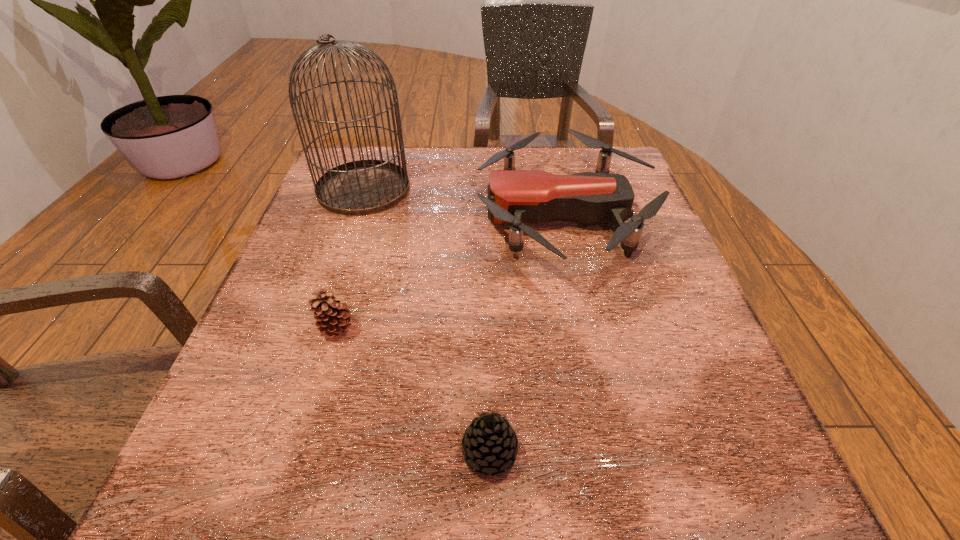
This screenshot has height=540, width=960. Identify the location of object that is at the far left corner. (363, 187).

This screenshot has height=540, width=960. Find the location of `object that is at the far right corner`. object that is at the far right corner is located at coordinates (517, 197).

This screenshot has height=540, width=960. In the image, there is a desktop. What are the coordinates of `vacant space at the far edge` in the screenshot? It's located at (421, 156).

This screenshot has width=960, height=540. I want to click on free region at the near edge of the desktop, so click(x=350, y=453).

I want to click on vacant space at the left edge, so click(x=286, y=436).

In the image, there is a desktop. Where is `vacant space at the right edge`? This screenshot has width=960, height=540. vacant space at the right edge is located at coordinates (643, 299).

You are a GUI agent. You are given a task and a screenshot of the screen. Output one action in this format:
    pyautogui.click(x=<x>, y=<y>)
    Task: Click on the vacant space at the near left corner of the desktop
    The image size is (960, 540).
    Given the screenshot: What is the action you would take?
    pyautogui.click(x=243, y=515)

This screenshot has height=540, width=960. What are the coordinates of `free space between the right pinecone and the drone` in the screenshot? It's located at (527, 334).

This screenshot has width=960, height=540. I want to click on vacant region between the tallest object and the shorter pinecone, so click(426, 320).

At what (x,y) coordinates should I click in order to perform the action: click on free space between the left pinecone and the shorter pinecone. Please return your answer as a coordinate pair (x, y). Image resolution: width=960 pixels, height=540 pixels. Looking at the image, I should click on (413, 389).